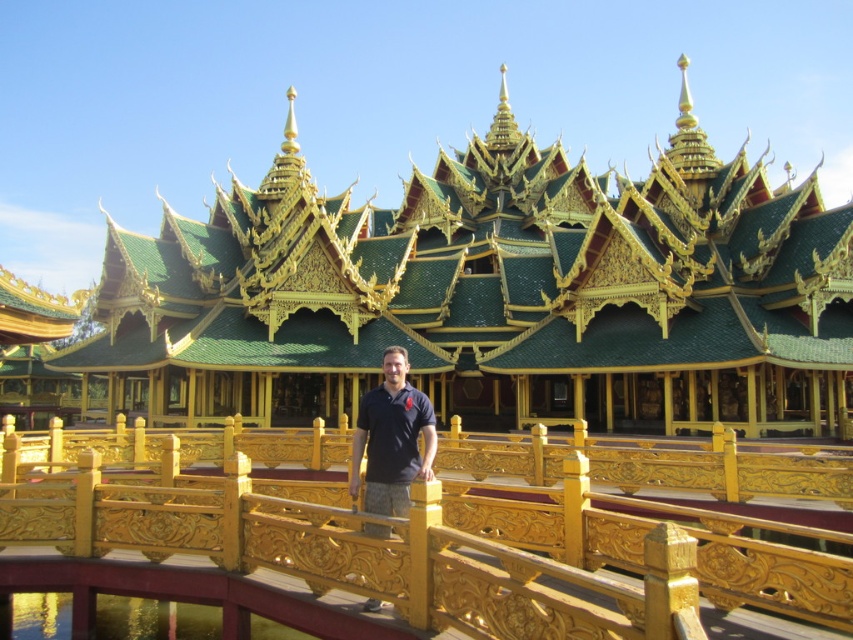
Question: Which of the following is the closest to the observer?

Choices:
 (A) (230, 412)
 (B) (474, 504)

Answer: (B)

Question: Does gold polished wood rail at center appear over dark blue polo shirt at center?

Choices:
 (A) no
 (B) yes

Answer: (A)

Question: Which object is farther from the camera taking this photo?

Choices:
 (A) green glazed tile palace at center
 (B) dark blue polo shirt at center
 (C) gold polished wood rail at center

Answer: (A)

Question: Does green glazed tile palace at center appear on the right side of gold polished wood rail at center?

Choices:
 (A) yes
 (B) no

Answer: (A)

Question: Does gold polished wood rail at center appear on the left side of dark blue polo shirt at center?

Choices:
 (A) no
 (B) yes

Answer: (B)

Question: Estimate the real-world distances between objects in this image. Which object is farther from the dark blue polo shirt at center?

Choices:
 (A) gold polished wood rail at center
 (B) green glazed tile palace at center

Answer: (B)